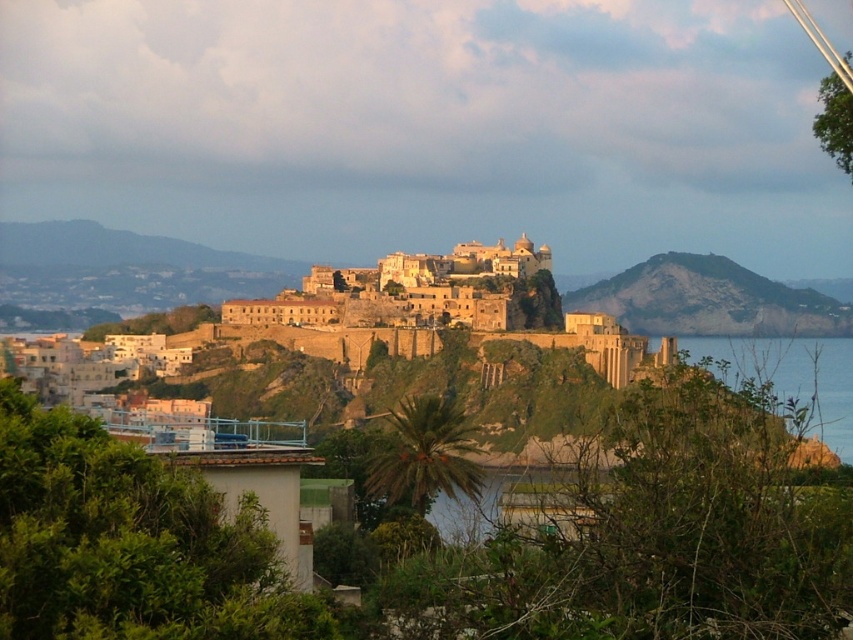
Question: Does yellow stone town at center appear over blue water at lower right?

Choices:
 (A) no
 (B) yes

Answer: (B)

Question: In this image, where is green rocky hillside at center located relative to blue water at lower right?

Choices:
 (A) below
 (B) above

Answer: (B)

Question: Which point is closer to the camera?

Choices:
 (A) (740, 346)
 (B) (683, 305)

Answer: (B)

Question: Which point is farther from the camera taking this photo?

Choices:
 (A) (737, 340)
 (B) (276, 285)
 (C) (606, 294)

Answer: (A)

Question: Can you confirm if yellow stone town at center is positioned to the left of green rocky hillside at center?

Choices:
 (A) yes
 (B) no

Answer: (A)

Question: Which of these objects is positioned closest to the yellow stone town at center?

Choices:
 (A) green rocky hillside at center
 (B) blue water at lower right

Answer: (A)